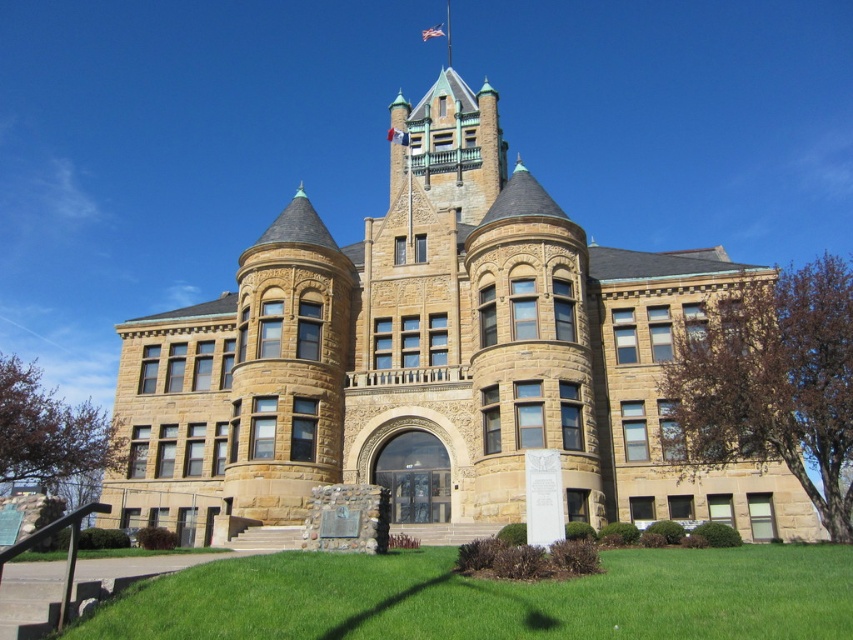
Is brown stone tower at center bigger than green grass at lower center?

Yes.

Which is in front, point (561, 440) or point (285, 604)?

Point (285, 604) is more forward.

Who is more forward, (334, 253) or (805, 582)?

Point (805, 582) is more forward.

Find the location of a particular element. brown stone tower at center is located at coordinates (428, 358).